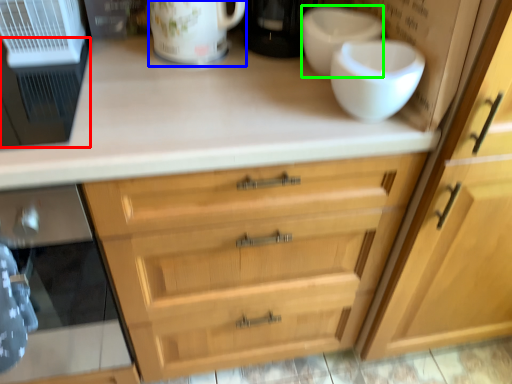
Question: Which object is positioned closest to appliance (highlighted by a red box)? Select from mug (highlighted by a blue box) and basin (highlighted by a green box).

Choices:
 (A) mug
 (B) basin

Answer: (A)